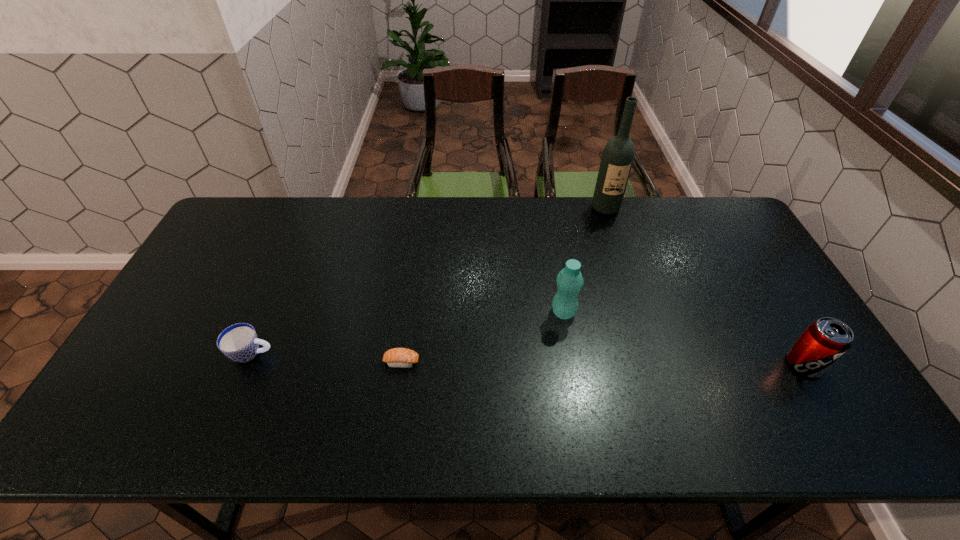
Find the location of a particular element. This screenshot has height=540, width=960. vacant space located 0.400m on the labeled side of the fourth object from left to right is located at coordinates (636, 303).

Identify the location of vacant point located 0.270m on the left of the bottle. (456, 313).

Find the location of a particular element. The height and width of the screenshot is (540, 960). vacant space situated 0.240m on the left of the soda can is located at coordinates (693, 364).

You are a GUI agent. You are given a task and a screenshot of the screen. Output one action in this format:
    pyautogui.click(x=<x>, y=<y>)
    Task: Click on the free space located on the side of the second shortest object with the handle
    
    Given the screenshot: What is the action you would take?
    pyautogui.click(x=350, y=353)

The height and width of the screenshot is (540, 960). Find the location of `blank area located on the right of the fourth object from right to left`. blank area located on the right of the fourth object from right to left is located at coordinates (555, 362).

Locate an element on the screen. This screenshot has width=960, height=540. object at the far edge is located at coordinates (617, 159).

The image size is (960, 540). What are the coordinates of `object positioned at the right edge` in the screenshot? It's located at (826, 340).

This screenshot has height=540, width=960. Identify the location of free spot at the far edge of the desktop. (463, 205).

I want to click on free space at the near edge, so click(x=595, y=413).

The width and height of the screenshot is (960, 540). Find the location of `free point at the left edge`. free point at the left edge is located at coordinates (235, 246).